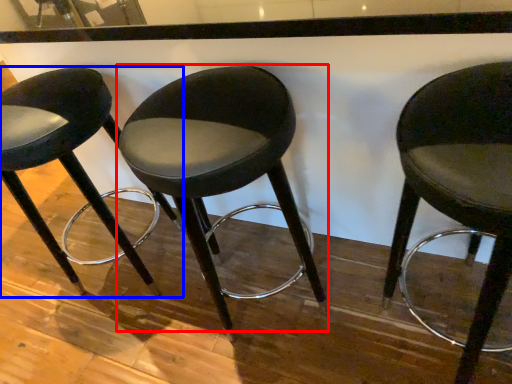
Question: Which object is closer to the camera taking this photo, chair (highlighted by a red box) or chair (highlighted by a blue box)?

Choices:
 (A) chair
 (B) chair

Answer: (A)